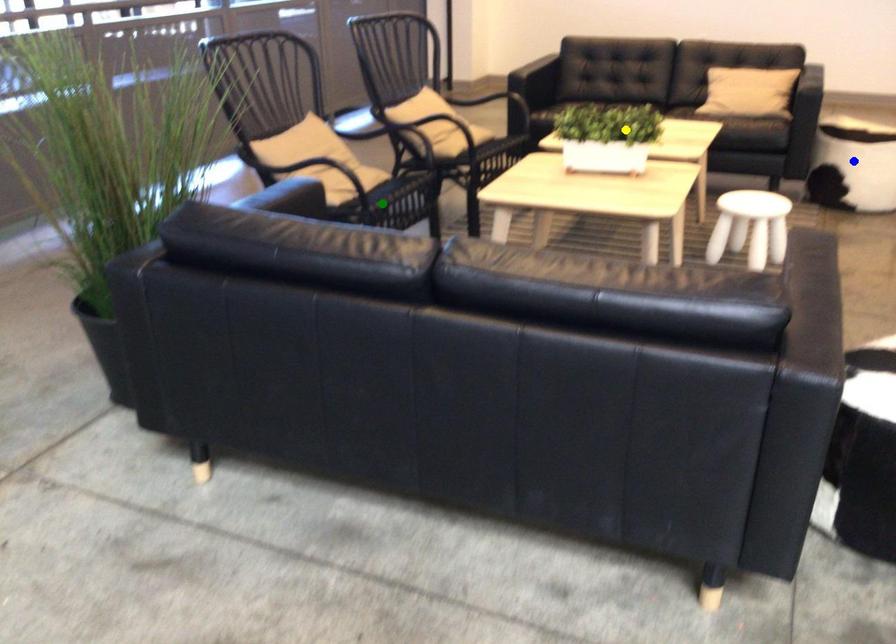
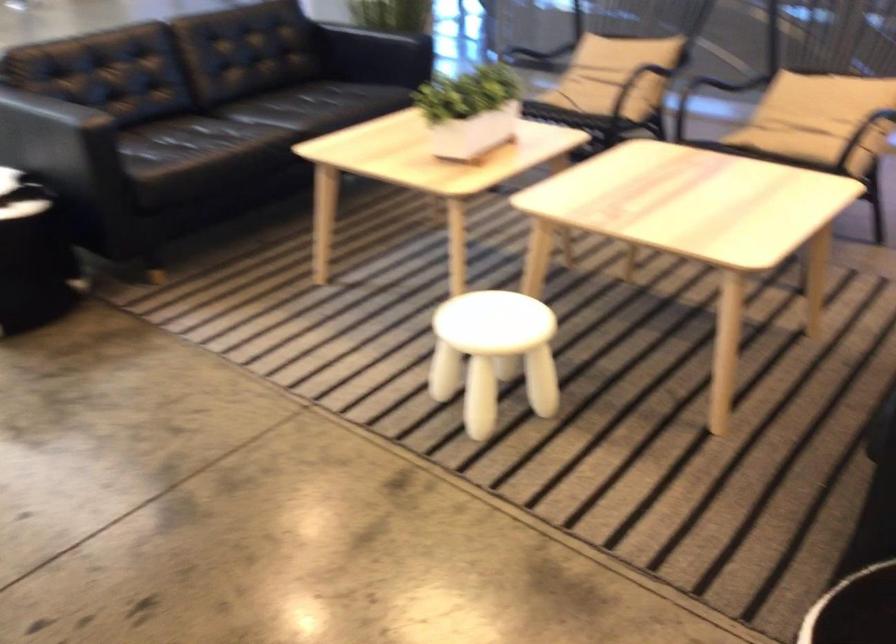
I am providing you with two images of the same scene from different viewpoints. Three points are marked in image1. Which point corresponds to a part or object that is occluded in image2?In image1, three points are marked. Which of them correspond to a part or object that is occluded in image2?Among the three points shown in image1, which one corresponds to a part or object that is no longer visible due to occlusion in image2?

Invisible in image2: green point, blue point.